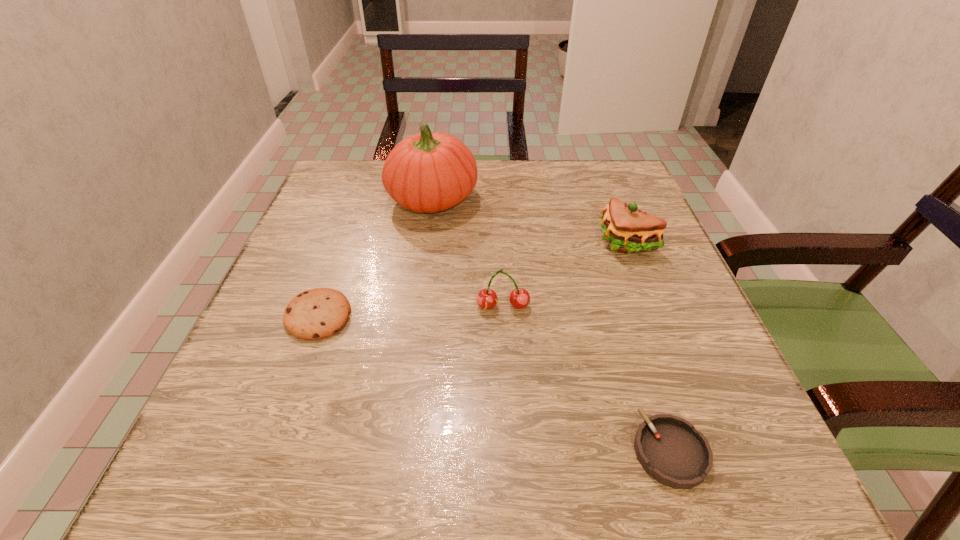
Image resolution: width=960 pixels, height=540 pixels. What are the coordinates of `free point that satisfies the following two spatial constraints: 1. with stems pointing upwards on the cherry; 2. on the left side of the shortest object` in the screenshot? It's located at (511, 450).

You are a GUI agent. You are given a task and a screenshot of the screen. Output one action in this format:
    pyautogui.click(x=<x>, y=<y>)
    Task: Click on the free point that satisfies the following two spatial constraints: 1. with stems pointing upwards on the cherry; 2. on the left side of the ashtray
    This screenshot has width=960, height=540.
    Given the screenshot: What is the action you would take?
    pyautogui.click(x=511, y=450)